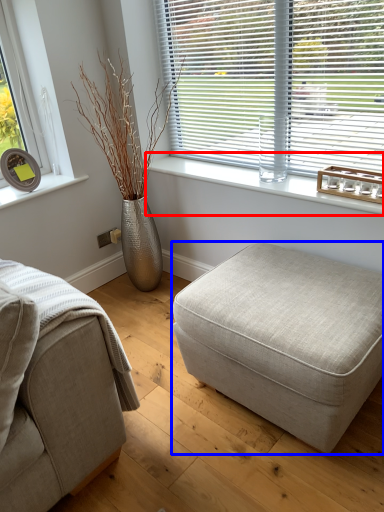
Question: Which object appears closest to the camera in this image, window sill (highlighted by a red box) or stool (highlighted by a blue box)?

Choices:
 (A) window sill
 (B) stool

Answer: (B)